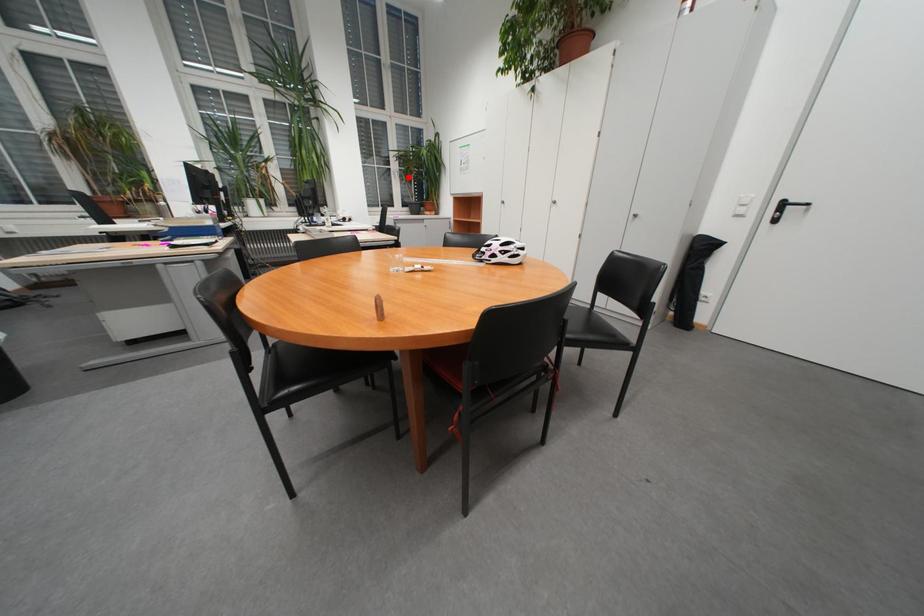
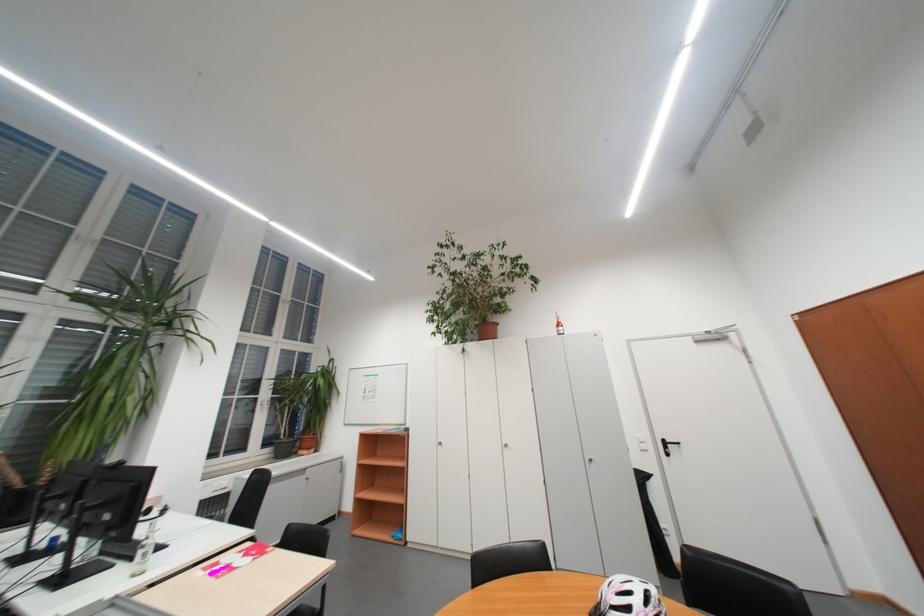
Question: A red point is marked in image1. In image2, is the corresponding 3D point closer to the camera or farther? Reply with the corresponding letter.

Choices:
 (A) The corresponding 3D point is closer.
 (B) The corresponding 3D point is farther.

Answer: (B)